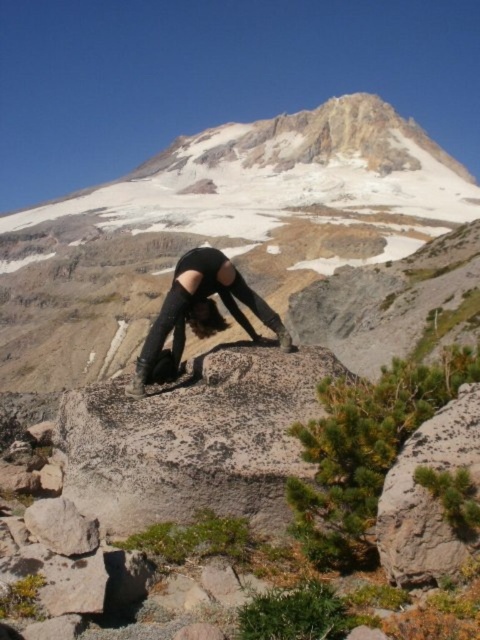
Question: Which point is farther to the camera?

Choices:
 (A) (85, 189)
 (B) (468, 388)

Answer: (A)

Question: Which point appears farthest from the camera in this image?

Choices:
 (A) (355, 224)
 (B) (411, 480)
 (C) (202, 337)

Answer: (A)

Question: Can you confirm if rocky mountain at center is wider than gray rough rock at lower right?

Choices:
 (A) no
 (B) yes

Answer: (B)

Question: Does rocky mountain at center have a larger size compared to gray rough rock at lower right?

Choices:
 (A) yes
 (B) no

Answer: (A)

Question: Which object appears closest to the camera in this image?

Choices:
 (A) black leather boots at center
 (B) rocky mountain at center

Answer: (A)

Question: Can you confirm if rocky mountain at center is smaller than black leather boots at center?

Choices:
 (A) yes
 (B) no

Answer: (B)